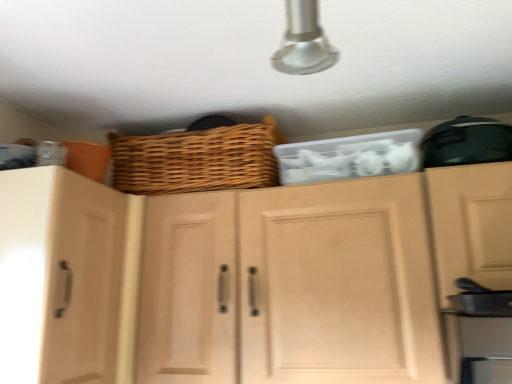
Question: Considering the positions of wooden cabinet doors at center, placed as the 2th cabinetry when sorted from left to right, and light wood cabinet at left, which is counted as the first cabinetry, starting from the left, in the image, is wooden cabinet doors at center, placed as the 2th cabinetry when sorted from left to right, bigger or smaller than light wood cabinet at left, which is counted as the first cabinetry, starting from the left,?

Choices:
 (A) big
 (B) small

Answer: (A)

Question: Is wooden cabinet doors at center, placed as the 2th cabinetry when sorted from left to right, inside the boundaries of light wood cabinet at left, arranged as the 2th cabinetry when viewed from the right, or outside?

Choices:
 (A) outside
 (B) inside

Answer: (A)

Question: Which object is the closest to the light wood cabinet at left, which is counted as the first cabinetry, starting from the left?

Choices:
 (A) wooden cabinet doors at center, placed as the 2th cabinetry when sorted from left to right
 (B) woven brown basket at upper center

Answer: (A)

Question: Based on their relative distances, which object is farther from the wooden cabinet doors at center, placed as the 2th cabinetry when sorted from left to right?

Choices:
 (A) woven brown basket at upper center
 (B) light wood cabinet at left, which is counted as the first cabinetry, starting from the left

Answer: (A)